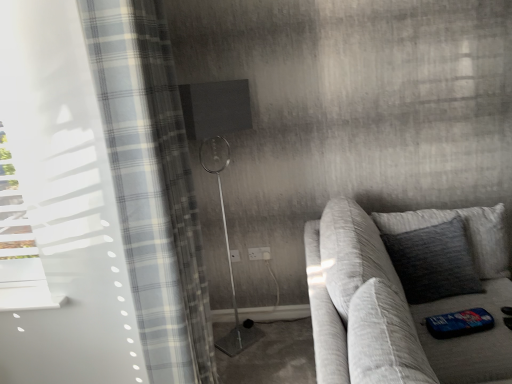
At what (x,y) coordinates should I click in order to perform the action: click on translucent plaid curtain at left. Please return your answer as a coordinate pair (x, y). Looking at the image, I should click on (152, 185).

The image size is (512, 384). Describe the element at coordinates (399, 301) in the screenshot. I see `textured gray couch at right` at that location.

Image resolution: width=512 pixels, height=384 pixels. I want to click on textured gray couch at right, so click(399, 301).

In order to face matte black shower at center, should I rotate leftwards or rightwards?

To face it directly, rotate left by 4.323 degrees.

Locate an element on the screen. white plastic electric outlet at center, which appears as the 2th electric outlet when viewed from the left is located at coordinates (x=259, y=253).

Identify the location of translucent plaid curtain at left. Image resolution: width=512 pixels, height=384 pixels. (152, 185).

Is white plastic electric outlet at center, which ranks as the first electric outlet in right-to-left order, thinner than matte black shower at center?

Yes.

Based on the photo, from the image's perspective, is white plastic electric outlet at center, which appears as the 2th electric outlet when viewed from the left, below matte black shower at center?

Yes.

In the scene shown: How many degrees apart are the facing directions of white plastic electric outlet at center, which ranks as the first electric outlet in right-to-left order, and matte black shower at center?

51.5 degrees.

In the scene shown: Does textured gray pillow at right have a smaller size compared to white plastic electric outlet at center, which appears as the 2th electric outlet when viewed from the left?

No, textured gray pillow at right is not smaller than white plastic electric outlet at center, which appears as the 2th electric outlet when viewed from the left.

Is textured gray pillow at right beside white plastic electric outlet at center, which appears as the 2th electric outlet when viewed from the left?

No, textured gray pillow at right is not in contact with white plastic electric outlet at center, which appears as the 2th electric outlet when viewed from the left.

Does point (441, 250) lie behind point (259, 247)?

No.

Between matte black shower at center and textured gray pillow at right, which one is positioned behind?

matte black shower at center is behind.

From their relative heights in the image, would you say matte black shower at center is taller or shorter than textured gray pillow at right?

Clearly, matte black shower at center is taller compared to textured gray pillow at right.

From the image's perspective, which is below, matte black shower at center or textured gray pillow at right?

textured gray pillow at right is shown below in the image.

Based on their positions, is matte black shower at center located to the left or right of textured gray pillow at right?

Based on their positions, matte black shower at center is located to the left of textured gray pillow at right.

Is textured gray couch at right beside white plastic electric outlet at center, which ranks as the first electric outlet in right-to-left order?

No, textured gray couch at right is not in contact with white plastic electric outlet at center, which ranks as the first electric outlet in right-to-left order.

Can we say textured gray couch at right lies outside white plastic electric outlet at center, which ranks as the first electric outlet in right-to-left order?

Yes, textured gray couch at right is outside of white plastic electric outlet at center, which ranks as the first electric outlet in right-to-left order.

Which object is thinner, textured gray couch at right or white plastic electric outlet at center, which appears as the 2th electric outlet when viewed from the left?

white plastic electric outlet at center, which appears as the 2th electric outlet when viewed from the left, is thinner.

From a real-world perspective, is matte black shower at center positioned above or below white plastic electric outlet at center, which appears as the 2th electric outlet when viewed from the left?

matte black shower at center is situated higher than white plastic electric outlet at center, which appears as the 2th electric outlet when viewed from the left, in the real world.

Is matte black shower at center not close to white plastic electric outlet at center, which appears as the 2th electric outlet when viewed from the left?

matte black shower at center is near white plastic electric outlet at center, which appears as the 2th electric outlet when viewed from the left, not far away.

Which object is thinner, matte black shower at center or white plastic electric outlet at center, which appears as the 2th electric outlet when viewed from the left?

Thinner between the two is white plastic electric outlet at center, which appears as the 2th electric outlet when viewed from the left.

How many degrees apart are the facing directions of matte black shower at center and white plastic electric outlet at center, which appears as the 2th electric outlet when viewed from the left?

51.5 degrees separate the facing orientations of matte black shower at center and white plastic electric outlet at center, which appears as the 2th electric outlet when viewed from the left.

From the textured gray couch at right, count 2nd electric outlets backward and point to it. Please provide its 2D coordinates.

[(234, 256)]

From a real-world perspective, who is located higher, textured gray couch at right or white plastic electric outlet at center, which is the 1th electric outlet in left-to-right order?

textured gray couch at right, from a real-world perspective.

Can you confirm if textured gray couch at right is smaller than white plastic electric outlet at center, which is the 1th electric outlet in left-to-right order?

No.

Is textured gray pillow at right located outside white plastic electric outlet at center, which is counted as the second electric outlet, starting from the right?

textured gray pillow at right is positioned outside white plastic electric outlet at center, which is counted as the second electric outlet, starting from the right.

How many degrees apart are the facing directions of textured gray pillow at right and white plastic electric outlet at center, which is the 1th electric outlet in left-to-right order?

2 degrees separate the facing orientations of textured gray pillow at right and white plastic electric outlet at center, which is the 1th electric outlet in left-to-right order.

Which object is positioned more to the right, textured gray pillow at right or white plastic electric outlet at center, which is the 1th electric outlet in left-to-right order?

Positioned to the right is textured gray pillow at right.

How much distance is there between textured gray pillow at right and white plastic electric outlet at center, which is the 1th electric outlet in left-to-right order?

1.21 meters.

Where is `shower located above the white plastic electric outlet at center, which appears as the 2th electric outlet when viewed from the left (from the image's perspective)`? This screenshot has height=384, width=512. shower located above the white plastic electric outlet at center, which appears as the 2th electric outlet when viewed from the left (from the image's perspective) is located at coordinates (220, 165).

Find the location of a particular element. This screenshot has height=384, width=512. pillow lying in front of the white plastic electric outlet at center, which ranks as the first electric outlet in right-to-left order is located at coordinates (434, 261).

From the image, which object appears to be farther from white plastic electric outlet at center, which ranks as the first electric outlet in right-to-left order, white plastic electric outlet at center, which is counted as the second electric outlet, starting from the right, or textured gray couch at right?

textured gray couch at right is further to white plastic electric outlet at center, which ranks as the first electric outlet in right-to-left order.

Looking at the image, which one is located further to textured gray pillow at right, matte black shower at center or white plastic electric outlet at center, which appears as the 2th electric outlet when viewed from the left?

Based on the image, matte black shower at center appears to be further to textured gray pillow at right.

Estimate the real-world distances between objects in this image. Which object is closer to textured gray couch at right, translucent plaid curtain at left or white plastic electric outlet at center, which is the 1th electric outlet in left-to-right order?

A: Based on the image, translucent plaid curtain at left appears to be nearer to textured gray couch at right.

When comparing their distances from textured gray pillow at right, does white plastic electric outlet at center, which is counted as the second electric outlet, starting from the right, or white plastic electric outlet at center, which ranks as the first electric outlet in right-to-left order, seem closer?

The object closer to textured gray pillow at right is white plastic electric outlet at center, which ranks as the first electric outlet in right-to-left order.

From the image, which object appears to be nearer to white plastic electric outlet at center, which is the 1th electric outlet in left-to-right order, white plastic electric outlet at center, which appears as the 2th electric outlet when viewed from the left, or matte black shower at center?

white plastic electric outlet at center, which appears as the 2th electric outlet when viewed from the left, is closer to white plastic electric outlet at center, which is the 1th electric outlet in left-to-right order.

Considering their positions, is textured gray pillow at right positioned further to textured gray couch at right than translucent plaid curtain at left?

Among the two, translucent plaid curtain at left is located further to textured gray couch at right.

When comparing their distances from translucent plaid curtain at left, does white plastic electric outlet at center, which appears as the 2th electric outlet when viewed from the left, or matte black shower at center seem closer?

matte black shower at center.

Looking at the image, which one is located closer to translucent plaid curtain at left, matte black shower at center or white plastic electric outlet at center, which is counted as the second electric outlet, starting from the right?

Based on the image, matte black shower at center appears to be nearer to translucent plaid curtain at left.

Image resolution: width=512 pixels, height=384 pixels. Find the location of `shower positioned between textured gray couch at right and white plastic electric outlet at center, which appears as the 2th electric outlet when viewed from the left, from near to far`. shower positioned between textured gray couch at right and white plastic electric outlet at center, which appears as the 2th electric outlet when viewed from the left, from near to far is located at coordinates (220, 165).

Identify the location of curtain located between textured gray couch at right and white plastic electric outlet at center, which ranks as the first electric outlet in right-to-left order, in the depth direction. (152, 185).

Find the location of `shower located between translucent plaid curtain at left and white plastic electric outlet at center, which is the 1th electric outlet in left-to-right order, in the depth direction`. shower located between translucent plaid curtain at left and white plastic electric outlet at center, which is the 1th electric outlet in left-to-right order, in the depth direction is located at coordinates (220, 165).

Identify the location of pillow between textured gray couch at right and white plastic electric outlet at center, which is the 1th electric outlet in left-to-right order, along the z-axis. (434, 261).